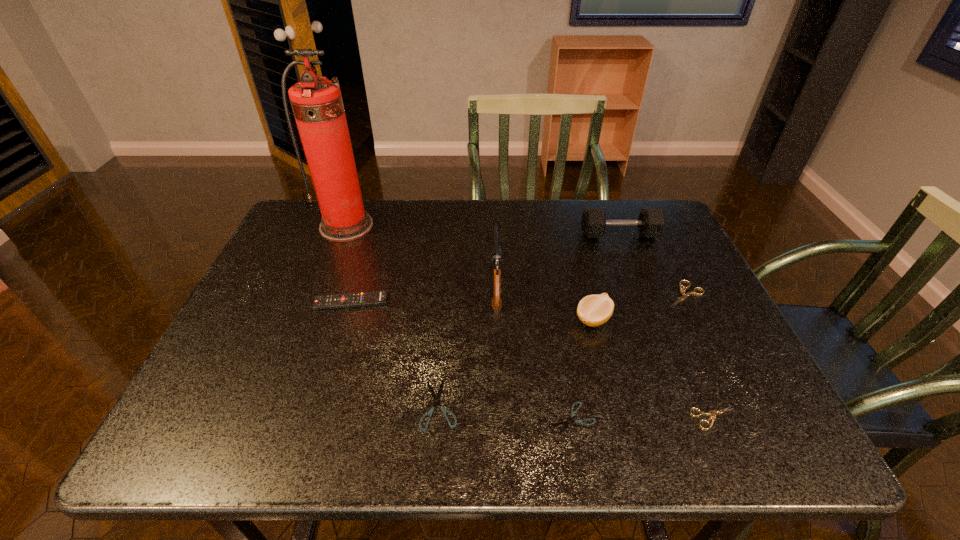
Identify the location of free region located 0.390m on the right of the remote control. The image size is (960, 540). (542, 302).

Where is `free location located 0.290m on the back of the tallest shears`? free location located 0.290m on the back of the tallest shears is located at coordinates (647, 218).

What are the coordinates of `blank area located on the back of the nearer beige shears` in the screenshot? It's located at (687, 355).

At what (x,y) coordinates should I click in order to perform the action: click on free space located on the back of the left black shears. Please return your answer as a coordinate pair (x, y). Looking at the image, I should click on (449, 277).

Locate an element on the screen. The width and height of the screenshot is (960, 540). vacant space located on the left of the smaller black shears is located at coordinates (458, 418).

Identify the location of fire extinguisher located at the far edge. This screenshot has height=540, width=960. (317, 104).

Find the location of a particular element. Image resolution: width=960 pixels, height=540 pixels. dumbbell at the far edge is located at coordinates (651, 222).

Where is `object present at the left edge`? This screenshot has width=960, height=540. object present at the left edge is located at coordinates (317, 104).

This screenshot has width=960, height=540. Find the location of `dumbbell situated at the right edge`. dumbbell situated at the right edge is located at coordinates (651, 222).

This screenshot has height=540, width=960. I want to click on object present at the far left corner, so click(317, 104).